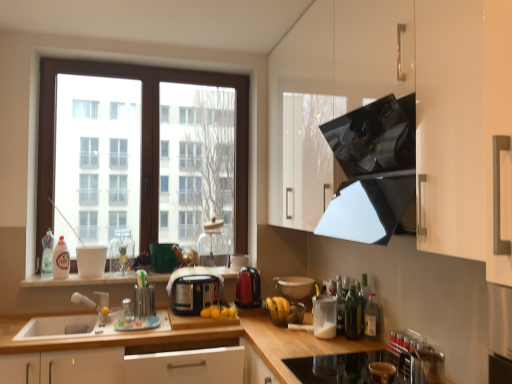
You are a GUI agent. You are given a task and a screenshot of the screen. Output one action in this format:
    pyautogui.click(x=<x>, y=<y>)
    Task: Click on the vacant area that is in front of white matte container at center, arranged as the second kitchen appliance when viewed from the back
    The width and height of the screenshot is (512, 384).
    Given the screenshot: What is the action you would take?
    pyautogui.click(x=322, y=345)